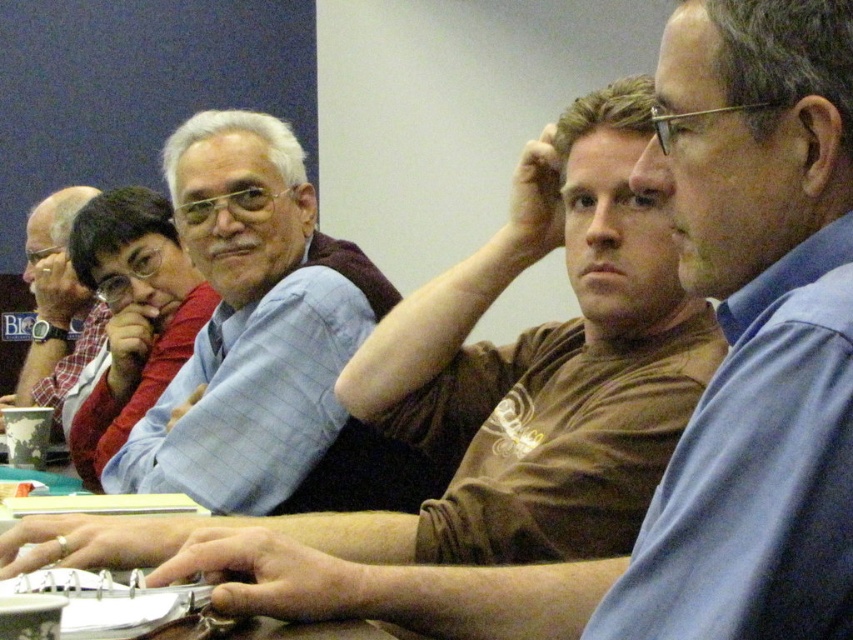
Between matte blue shirt at center and matte red sweater at center, which one has less height?

matte blue shirt at center is shorter.

Image resolution: width=853 pixels, height=640 pixels. In order to click on matte blue shirt at center in this screenshot , I will do `click(262, 339)`.

Image resolution: width=853 pixels, height=640 pixels. I want to click on matte blue shirt at center, so click(262, 339).

Who is more distant from viewer, (173, 336) or (218, 522)?

The point (173, 336) is behind.

Does matte red sweater at center have a greater height compared to brown leather table at center?

Yes, matte red sweater at center is taller than brown leather table at center.

Is point (152, 234) closer to viewer compared to point (128, 544)?

No.

The image size is (853, 640). Find the location of `matte red sweater at center`. matte red sweater at center is located at coordinates (132, 316).

Can you confirm if matte red sweater at center is positioned below plaid shirt at left?

Correct, matte red sweater at center is located below plaid shirt at left.

Find the location of `matte red sweater at center`. matte red sweater at center is located at coordinates (132, 316).

At what (x,y) coordinates should I click in order to perform the action: click on matte red sweater at center. Please return your answer as a coordinate pair (x, y). This screenshot has width=853, height=640. Looking at the image, I should click on (132, 316).